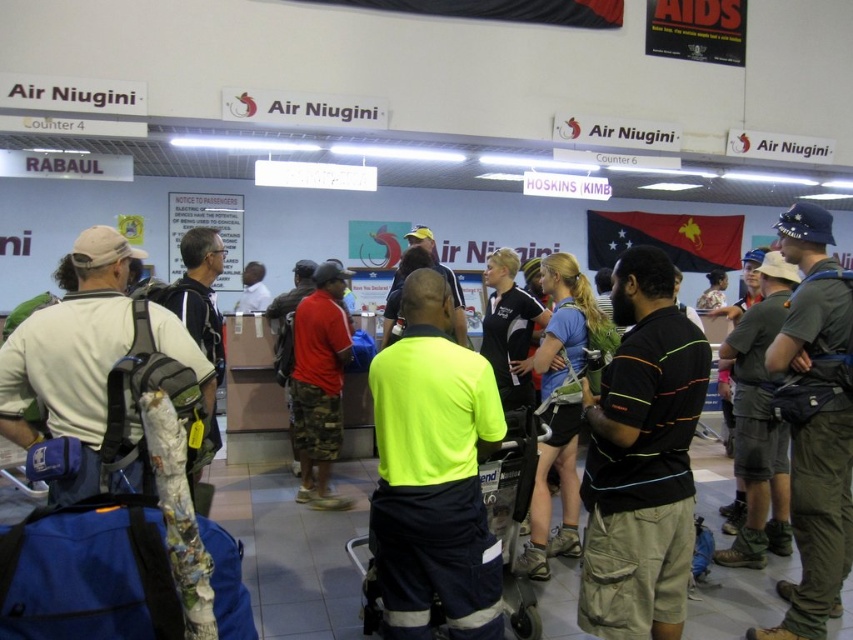
Does neon yellow shirt at center have a lesser width compared to red cotton shirt at center?

In fact, neon yellow shirt at center might be wider than red cotton shirt at center.

Between point (459, 602) and point (335, 298), which one is positioned in front?

Positioned in front is point (459, 602).

Describe the element at coordinates (433, 474) in the screenshot. I see `neon yellow shirt at center` at that location.

Locate an element on the screen. neon yellow shirt at center is located at coordinates (433, 474).